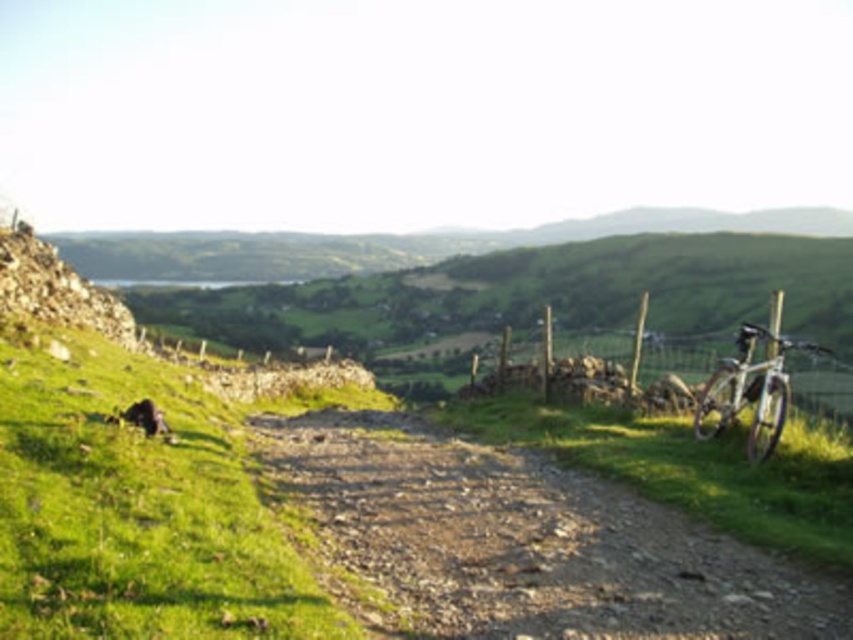
Question: Which of the following is the farthest from the observer?

Choices:
 (A) fuzzy brown dog at lower left
 (B) dusty gravel path at center
 (C) silver metallic mountain bike at right

Answer: (A)

Question: Is dusty gravel path at center behind silver metallic mountain bike at right?

Choices:
 (A) no
 (B) yes

Answer: (A)

Question: Among these points, which one is nearest to the camera?

Choices:
 (A) (759, 365)
 (B) (729, 392)
 (C) (161, 413)
 (D) (413, 444)

Answer: (A)

Question: Does dusty gravel path at center appear under wooden post at right?

Choices:
 (A) no
 (B) yes

Answer: (B)

Question: Considering the real-world distances, which object is farthest from the fuzzy brown dog at lower left?

Choices:
 (A) dusty gravel path at center
 (B) silver metallic mountain bike at right
 (C) wooden post at right

Answer: (C)

Question: Is wooden post at right smaller than fuzzy brown dog at lower left?

Choices:
 (A) yes
 (B) no

Answer: (B)